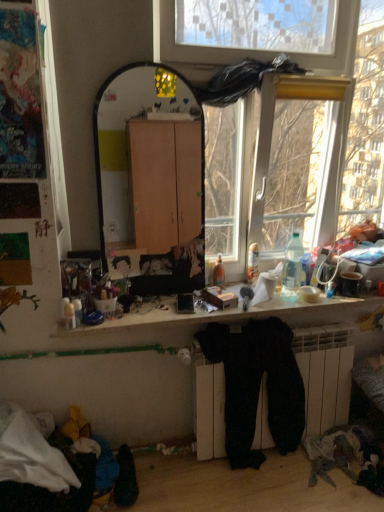
Question: Looking at their shapes, would you say black velvet pants at lower center is wider or thinner than clear plastic bottle at right?

Choices:
 (A) wide
 (B) thin

Answer: (A)

Question: From a real-world perspective, is black velvet pants at lower center physically located above or below clear plastic bottle at right?

Choices:
 (A) below
 (B) above

Answer: (A)

Question: Considering the real-world distances, which object is farthest from the wooden desk at center?

Choices:
 (A) silky black fabric at center, the 2th person in the left-to-right sequence
 (B) clear plastic bottle at right
 (C) smooth plastic figurine at center, which is counted as the 1th person, starting from the left
 (D) black velvet pants at lower center

Answer: (C)

Question: Estimate the real-world distances between objects in this image. Which object is farther from the silky black fabric at center, the 2th person in the left-to-right sequence?

Choices:
 (A) black velvet pants at lower center
 (B) wooden desk at center
 (C) smooth plastic figurine at center, which ranks as the second person in right-to-left order
 (D) clear plastic bottle at right

Answer: (A)